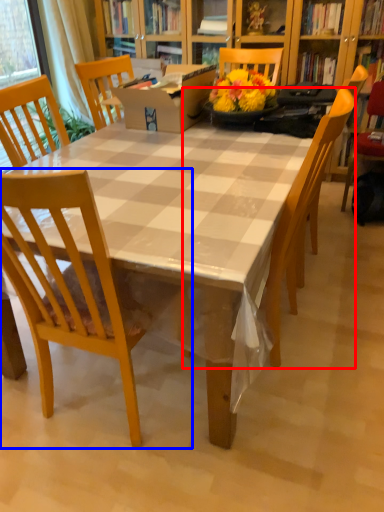
Question: Among these objects, which one is nearest to the camera, chair (highlighted by a red box) or chair (highlighted by a blue box)?

Choices:
 (A) chair
 (B) chair

Answer: (B)